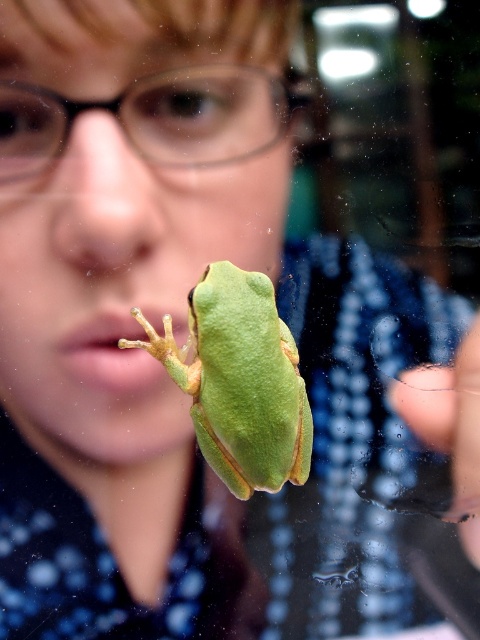
Question: Can you confirm if green matte/fuzzy frog at center is positioned to the left of black plastic glasses at upper center?

Choices:
 (A) yes
 (B) no

Answer: (B)

Question: Among these points, which one is nearest to the camera?

Choices:
 (A) (278, 400)
 (B) (475, 442)
 (C) (6, 118)

Answer: (C)

Question: Which point is farther to the camera?

Choices:
 (A) black plastic glasses at upper center
 (B) green matte/fuzzy frog at center

Answer: (B)

Question: Is green matte/fuzzy frog at center below transparent glass finger at lower right?

Choices:
 (A) no
 (B) yes

Answer: (A)

Question: Which is farther from the green matte/fuzzy frog at center?

Choices:
 (A) transparent glass finger at lower right
 (B) black plastic glasses at upper center

Answer: (B)

Question: Considering the relative positions of green matte/fuzzy frog at center and transparent glass finger at lower right in the image provided, where is green matte/fuzzy frog at center located with respect to transparent glass finger at lower right?

Choices:
 (A) above
 (B) below

Answer: (A)